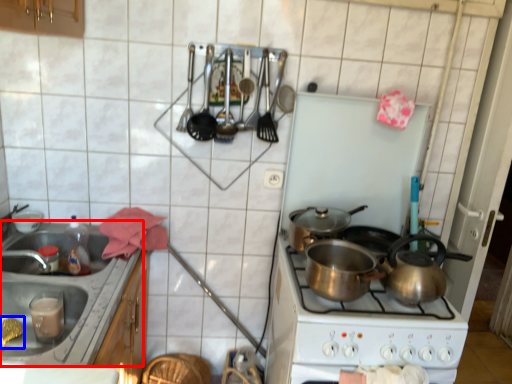
Question: Which point is further to the camera, sink (highlighted by a red box) or food (highlighted by a blue box)?

Choices:
 (A) sink
 (B) food

Answer: (B)